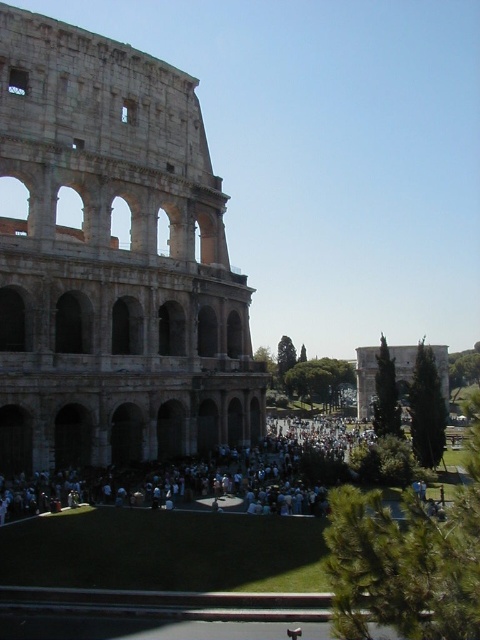
You are a tourist standing in front of the stone amphitheater at left and the white cloth crowd at center. Which object is taller?

The stone amphitheater at left is much taller than the white cloth crowd at center.

You are standing at the point labeled as point (113, 260) in the Colosseum scene. Which structure are you currently on?

The point labeled as point (113, 260) is on the stone amphitheater at left, so you are currently on the stone amphitheater at left.

You are a photographer planning to capture a wide shot of the stone amphitheater at left and the white cloth crowd at center. Based on their positions, which object should appear higher in the photo?

The stone amphitheater at left appears higher in the photo because it is located above the white cloth crowd at center.